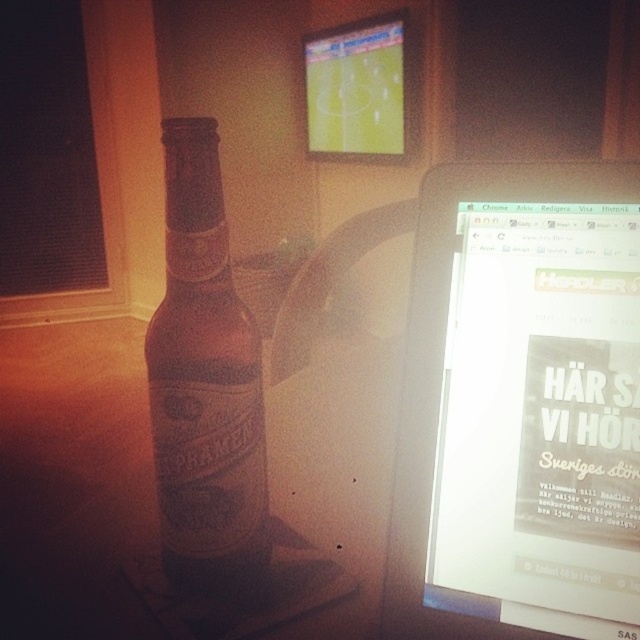
In the scene shown: How far apart are white glossy computer monitor at upper right and brown glass bottle at left?

white glossy computer monitor at upper right is 5.22 inches away from brown glass bottle at left.

From the picture: Is white glossy computer monitor at upper right positioned behind brown glass bottle at left?

That is False.

Identify the location of white glossy computer monitor at upper right. (518, 404).

Identify the location of white glossy computer monitor at upper right. The height and width of the screenshot is (640, 640). (518, 404).

Consider the image. Can you confirm if white glossy computer monitor at upper right is bigger than matte plastic screen at upper center?

No, white glossy computer monitor at upper right is not bigger than matte plastic screen at upper center.

Looking at this image, how far apart are white glossy computer monitor at upper right and matte plastic screen at upper center?

They are 2.99 meters apart.

This screenshot has width=640, height=640. What do you see at coordinates (518, 404) in the screenshot? I see `white glossy computer monitor at upper right` at bounding box center [518, 404].

Identify the location of white glossy computer monitor at upper right. This screenshot has height=640, width=640. (518, 404).

Is brown glass bottle at left positioned at the back of matte plastic screen at upper center?

No.

Is point (218, 340) behind point (387, 17)?

No.

This screenshot has height=640, width=640. I want to click on brown glass bottle at left, so click(204, 381).